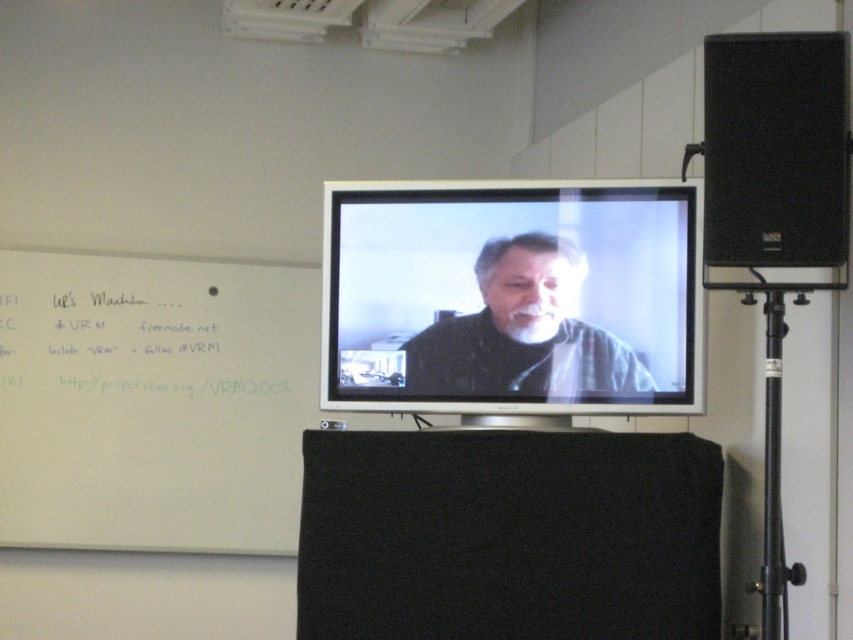
Question: Which point is closer to the camera?

Choices:
 (A) white paper at upper left
 (B) white matte whiteboard at left

Answer: (B)

Question: Which point is farther to the camera?

Choices:
 (A) click(x=250, y=435)
 (B) click(x=665, y=241)
 (C) click(x=444, y=355)
 (D) click(x=822, y=243)

Answer: (A)

Question: In this image, where is matte silver tv at center located relative to matte black shirt at center?

Choices:
 (A) above
 (B) below

Answer: (A)

Question: Is black foam speaker at upper right bigger than white paper at upper left?

Choices:
 (A) yes
 (B) no

Answer: (B)

Question: In this image, where is black fabric at lower center located relative to white paper at upper left?

Choices:
 (A) above
 (B) below

Answer: (B)

Question: Among these points, which one is nearest to the camera?

Choices:
 (A) click(225, 307)
 (B) click(448, 250)

Answer: (B)